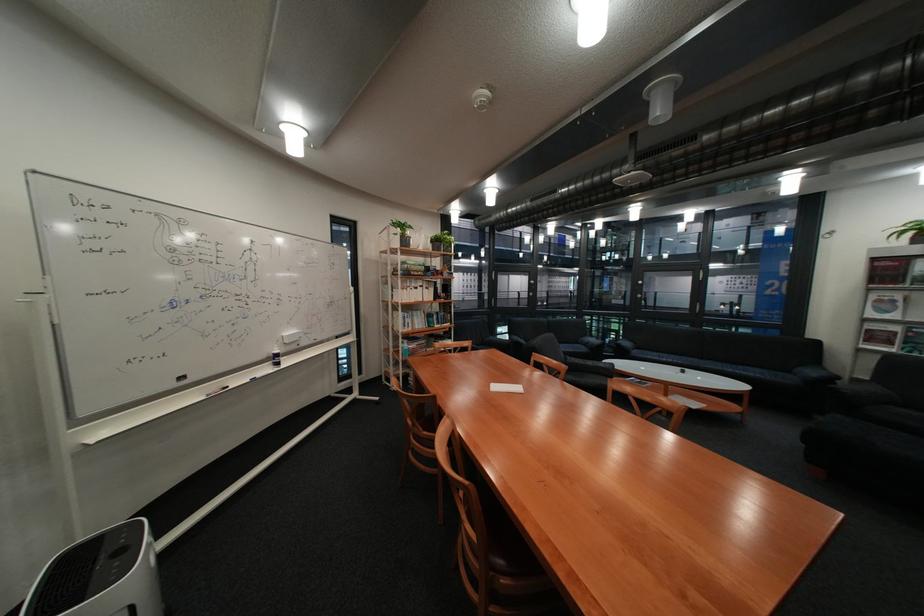
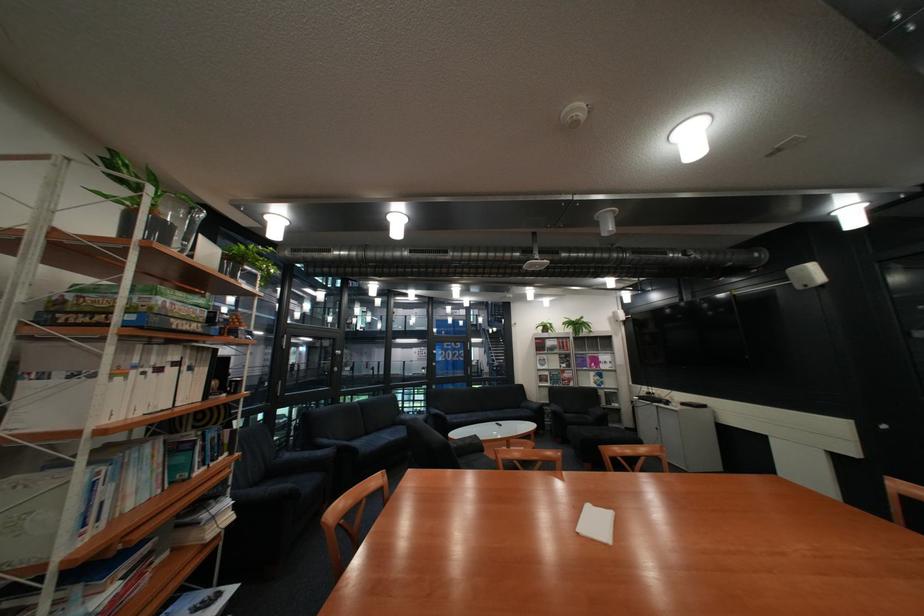
In the second image, find the point that corresponds to (417,270) in the first image.

(141, 312)